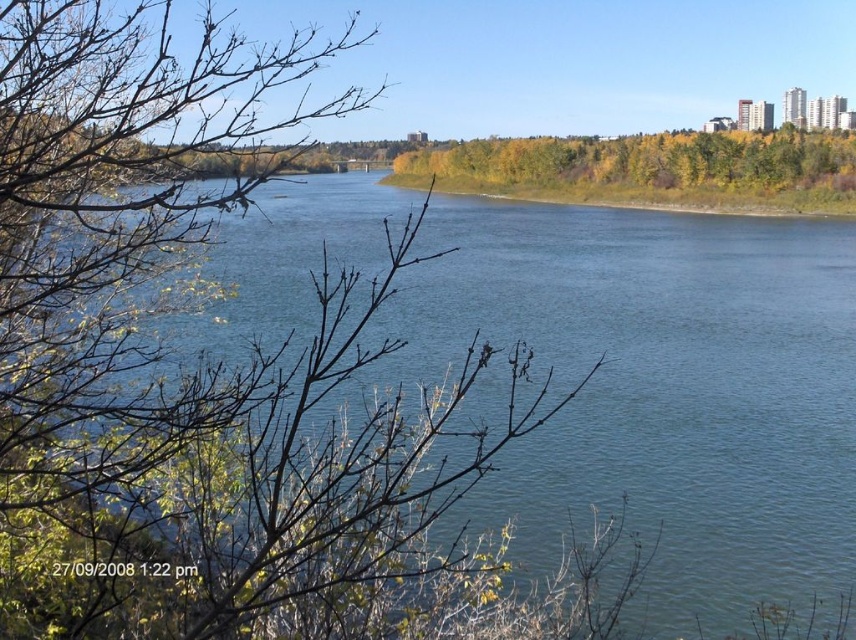
Question: Is blue water at center below green leafy vegetation at center?

Choices:
 (A) yes
 (B) no

Answer: (A)

Question: Is green leafy trees at center positioned before green leafy vegetation at center?

Choices:
 (A) yes
 (B) no

Answer: (B)

Question: Observing the image, what is the correct spatial positioning of green leafy trees at center in reference to green leafy vegetation at center?

Choices:
 (A) above
 (B) below

Answer: (A)

Question: Considering the real-world distances, which object is closest to the green leafy trees at center?

Choices:
 (A) blue water at center
 (B) green leafy vegetation at center

Answer: (B)

Question: Which of the following is the closest to the observer?

Choices:
 (A) (560, 195)
 (B) (265, 332)

Answer: (B)

Question: Which point is closer to the camera?

Choices:
 (A) (319, 186)
 (B) (547, 161)
 (C) (789, 193)

Answer: (C)